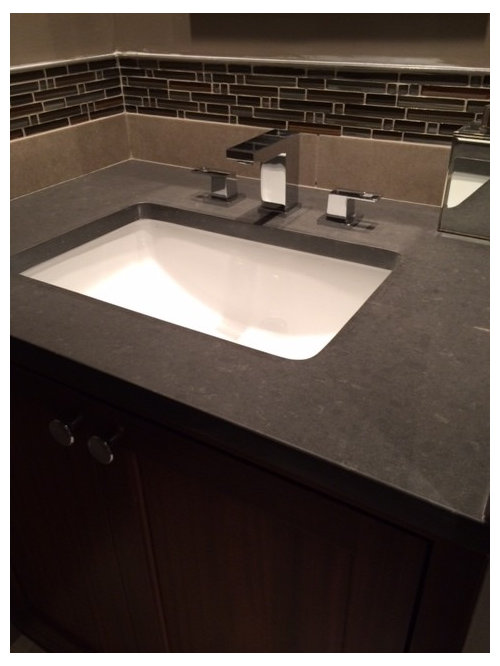
At what (x,y) coordinates should I click in order to perform the action: click on shadow of a mirror on the wall. Please return your answer as a coordinate pair (x, y). Looking at the image, I should click on (336, 33).